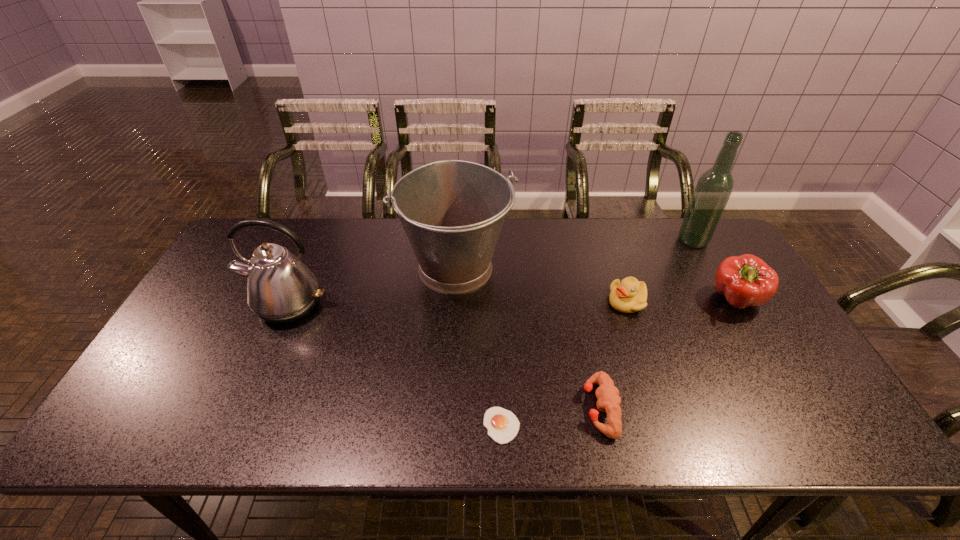
Where is `vacant point located between the leftmost object and the bucket`? The width and height of the screenshot is (960, 540). vacant point located between the leftmost object and the bucket is located at coordinates (372, 286).

This screenshot has width=960, height=540. I want to click on free spot between the bucket and the pepper, so click(596, 284).

The width and height of the screenshot is (960, 540). Identify the location of the second closest object to the puncher. (629, 295).

Select which object is the fourth closest to the leftmost object. Please provide its 2D coordinates. Your answer should be formatted as a tuple, i.e. [(x, y)], where the tuple contains the x and y coordinates of a point satisfying the conditions above.

[(629, 295)]

In order to click on blank area in the image that satisfies the following two spatial constraints: 1. from the spout of the kettle; 2. on the right side of the shortest object in this screenshot , I will do `click(234, 426)`.